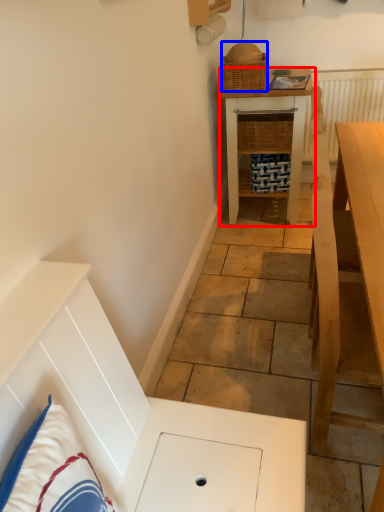
Question: Which object appears closest to the camera in this image, table (highlighted by a red box) or picnic basket (highlighted by a blue box)?

Choices:
 (A) table
 (B) picnic basket

Answer: (B)